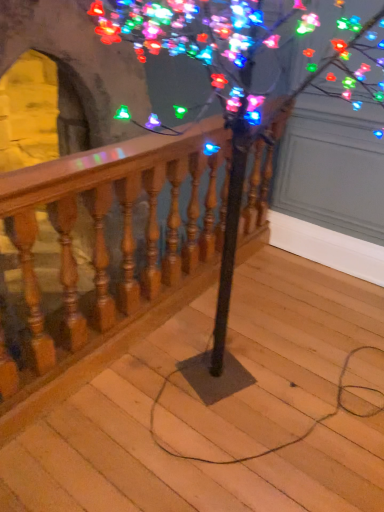
Measure the distance between point [255,198] and camera.

The distance of point [255,198] from camera is 2.44 meters.

The width and height of the screenshot is (384, 512). What are the coordinates of `wooden baluster at center` in the screenshot? It's located at (107, 239).

Is multicolored lights at upper center surrounded by wooden at center?

That's incorrect, multicolored lights at upper center is not inside wooden at center.

Between wooden at center and multicolored lights at upper center, which one has smaller size?

With smaller size is wooden at center.

Consider the image. From a real-world perspective, who is located higher, wooden baluster at center or wooden at center?

wooden baluster at center is physically above.

From the image's perspective, relative to wooden at center, is wooden baluster at center above or below?

Clearly, from the image's perspective, wooden baluster at center is above wooden at center.

Is multicolored lights at upper center taller than wooden baluster at center?

Correct, multicolored lights at upper center is much taller as wooden baluster at center.

From a real-world perspective, is multicolored lights at upper center located higher than wooden baluster at center?

Yes.

Can you confirm if multicolored lights at upper center is positioned to the right of wooden baluster at center?

Indeed, multicolored lights at upper center is positioned on the right side of wooden baluster at center.

Does point (263, 118) lie behind point (261, 138)?

No.

Is wooden baluster at center bigger than multicolored lights at upper center?

No, wooden baluster at center is not bigger than multicolored lights at upper center.

From the image's perspective, is wooden baluster at center located above or below multicolored lights at upper center?

wooden baluster at center is situated higher than multicolored lights at upper center in the image.

Which of these two, wooden baluster at center or multicolored lights at upper center, is wider?

multicolored lights at upper center is wider.

Is wooden at center aimed at wooden baluster at center?

No, wooden at center does not turn towards wooden baluster at center.

Between point (113, 440) and point (62, 328), which one is positioned behind?

Positioned behind is point (62, 328).

In the image, is wooden at center positioned in front of or behind wooden baluster at center?

In the image, wooden at center appears in front of wooden baluster at center.

Is wooden at center placed right next to wooden baluster at center?

wooden at center and wooden baluster at center are clearly separated.

Considering the relative sizes of multicolored lights at upper center and wooden at center in the image provided, is multicolored lights at upper center shorter than wooden at center?

→ No.

From a real-world perspective, which is physically below, multicolored lights at upper center or wooden at center?

wooden at center is physically lower.

Would you say multicolored lights at upper center is to the left or to the right of wooden at center in the picture?

multicolored lights at upper center is to the right of wooden at center.

You are a GUI agent. You are given a task and a screenshot of the screen. Output one action in this format:
    pyautogui.click(x=<x>, y=<y>)
    Task: Click on the stairs behind the multicolored lights at upper center
    
    Given the screenshot: What is the action you would take?
    pyautogui.click(x=170, y=456)

The height and width of the screenshot is (512, 384). I want to click on stairs located on the left of multicolored lights at upper center, so click(170, 456).

You are a GUI agent. You are given a task and a screenshot of the screen. Output one action in this format:
    pyautogui.click(x=<x>, y=<y>)
    Task: Click on the stairs below the wooden baluster at center (from a real-world perspective)
    The height and width of the screenshot is (512, 384).
    Given the screenshot: What is the action you would take?
    pyautogui.click(x=170, y=456)

Looking at the image, which one is located further to wooden baluster at center, wooden at center or multicolored lights at upper center?

wooden at center.

Which object lies nearer to the anchor point multicolored lights at upper center, wooden at center or wooden baluster at center?

Among the two, wooden baluster at center is located nearer to multicolored lights at upper center.

Which object lies nearer to the anchor point multicolored lights at upper center, wooden baluster at center or wooden at center?

Among the two, wooden baluster at center is located nearer to multicolored lights at upper center.

From the image, which object appears to be nearer to wooden at center, wooden baluster at center or multicolored lights at upper center?

wooden baluster at center is closer to wooden at center.

When comparing their distances from wooden at center, does multicolored lights at upper center or wooden baluster at center seem closer?

wooden baluster at center lies closer to wooden at center than the other object.

Which object lies further to the anchor point wooden baluster at center, multicolored lights at upper center or wooden at center?

wooden at center is positioned further to the anchor wooden baluster at center.

At what (x,y) coordinates should I click in order to perform the action: click on stairs between multicolored lights at upper center and wooden baluster at center along the z-axis. Please return your answer as a coordinate pair (x, y). Looking at the image, I should click on (170, 456).